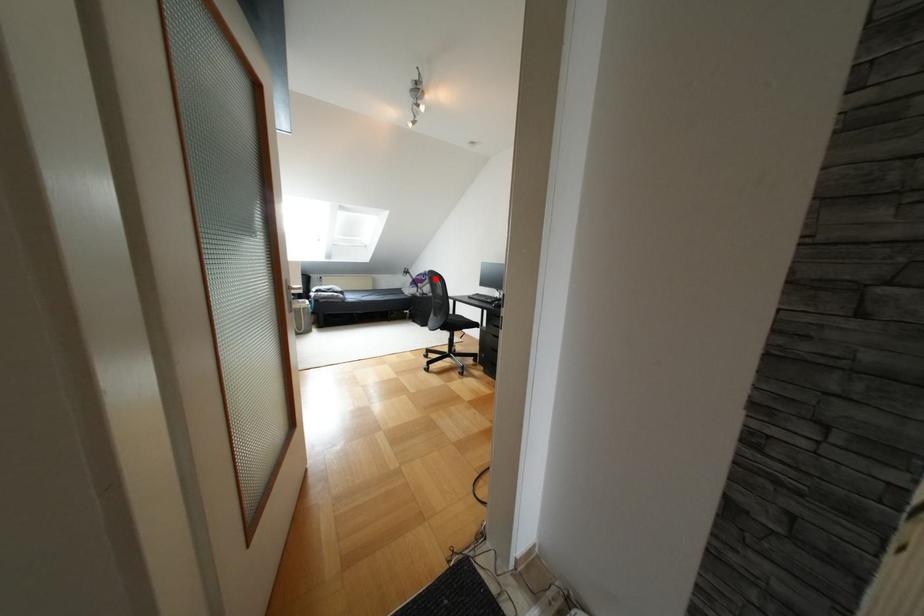
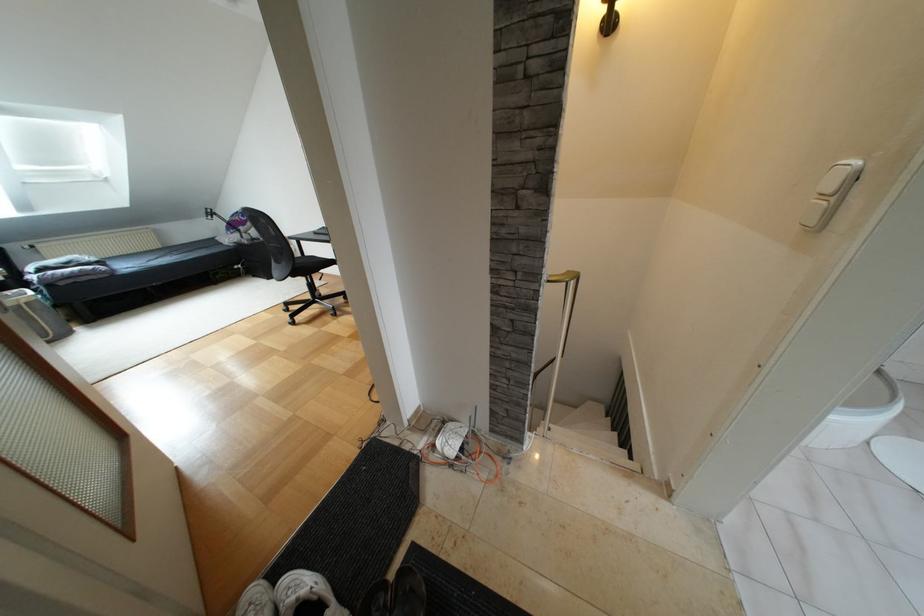
In the second image, find the point that corresponds to the highlighted location in the first image.

(258, 217)